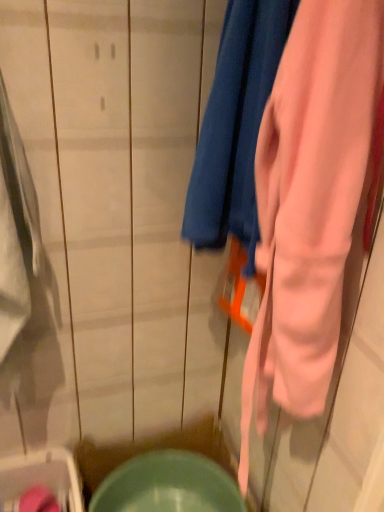
Question: Can matte green bowl at lower center be found inside matte green plastic washer at lower left?

Choices:
 (A) no
 (B) yes

Answer: (A)

Question: Could you tell me if matte green plastic washer at lower left is facing matte green bowl at lower center?

Choices:
 (A) no
 (B) yes

Answer: (A)

Question: Does matte green plastic washer at lower left come behind matte green bowl at lower center?

Choices:
 (A) yes
 (B) no

Answer: (B)

Question: From the image's perspective, is matte green plastic washer at lower left beneath matte green bowl at lower center?

Choices:
 (A) no
 (B) yes

Answer: (A)

Question: Can you confirm if matte green plastic washer at lower left is wider than matte green bowl at lower center?

Choices:
 (A) no
 (B) yes

Answer: (A)

Question: Is matte green bowl at lower center taller or shorter than matte green plastic washer at lower left?

Choices:
 (A) short
 (B) tall

Answer: (B)

Question: Is point (110, 492) positioned closer to the camera than point (8, 497)?

Choices:
 (A) closer
 (B) farther

Answer: (B)

Question: Considering their positions, is matte green bowl at lower center located in front of or behind matte green plastic washer at lower left?

Choices:
 (A) front
 (B) behind

Answer: (B)

Question: From the image's perspective, is matte green bowl at lower center above or below matte green plastic washer at lower left?

Choices:
 (A) below
 (B) above

Answer: (A)

Question: Is pink soft fabric towel at center inside or outside of matte green plastic washer at lower left?

Choices:
 (A) outside
 (B) inside

Answer: (A)

Question: Is pink soft fabric towel at center taller or shorter than matte green plastic washer at lower left?

Choices:
 (A) tall
 (B) short

Answer: (A)

Question: Would you say pink soft fabric towel at center is to the left or to the right of matte green plastic washer at lower left in the picture?

Choices:
 (A) right
 (B) left

Answer: (A)

Question: From the image's perspective, relative to matte green plastic washer at lower left, is pink soft fabric towel at center above or below?

Choices:
 (A) above
 (B) below

Answer: (A)

Question: Is pink soft fabric towel at center spatially inside matte green bowl at lower center, or outside of it?

Choices:
 (A) outside
 (B) inside

Answer: (A)

Question: From a real-world perspective, is pink soft fabric towel at center physically located above or below matte green bowl at lower center?

Choices:
 (A) above
 (B) below

Answer: (A)